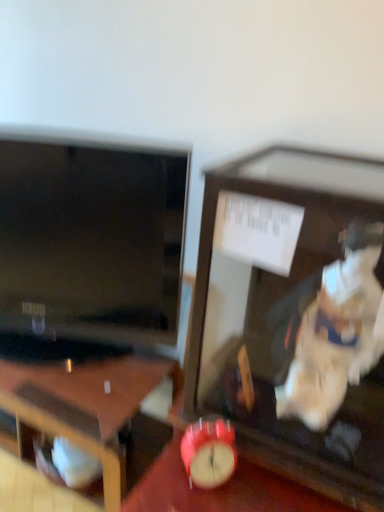
Question: Is wooden display case at center at the right side of wooden desk at lower left?

Choices:
 (A) yes
 (B) no

Answer: (A)

Question: From the image's perspective, is wooden display case at center located above wooden desk at lower left?

Choices:
 (A) no
 (B) yes

Answer: (B)

Question: Is wooden desk at lower left inside wooden display case at center?

Choices:
 (A) no
 (B) yes

Answer: (A)

Question: Can you confirm if wooden display case at center is taller than wooden desk at lower left?

Choices:
 (A) no
 (B) yes

Answer: (A)

Question: From the image's perspective, is wooden display case at center located beneath wooden desk at lower left?

Choices:
 (A) no
 (B) yes

Answer: (A)

Question: Is wooden display case at center oriented away from wooden desk at lower left?

Choices:
 (A) yes
 (B) no

Answer: (B)

Question: Would you say matte red alarm clock at center contains wooden desk at lower left?

Choices:
 (A) yes
 (B) no

Answer: (B)

Question: Considering the relative sizes of matte red alarm clock at center and wooden desk at lower left in the image provided, is matte red alarm clock at center taller than wooden desk at lower left?

Choices:
 (A) yes
 (B) no

Answer: (B)

Question: Can you confirm if matte red alarm clock at center is bigger than wooden desk at lower left?

Choices:
 (A) yes
 (B) no

Answer: (B)

Question: From the image's perspective, is matte red alarm clock at center on wooden desk at lower left?

Choices:
 (A) yes
 (B) no

Answer: (B)

Question: Considering the relative sizes of matte red alarm clock at center and wooden desk at lower left in the image provided, is matte red alarm clock at center wider than wooden desk at lower left?

Choices:
 (A) yes
 (B) no

Answer: (B)

Question: Is matte red alarm clock at center to the right of wooden desk at lower left from the viewer's perspective?

Choices:
 (A) yes
 (B) no

Answer: (A)

Question: From a real-world perspective, does matte red alarm clock at lower right stand above matte black tv at left?

Choices:
 (A) no
 (B) yes

Answer: (A)